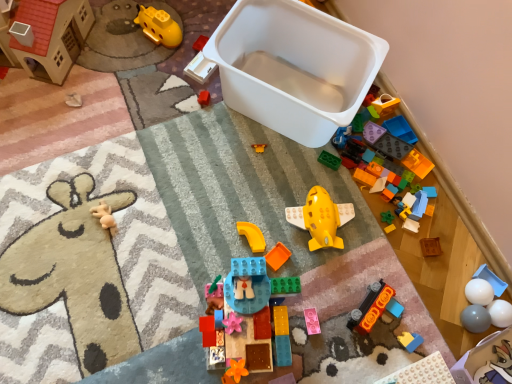
Locate an element on the screen. Image resolution: width=512 pixels, height=384 pixels. free space to the back side of translucent blue plastic building block at center, the 12th toy from the right is located at coordinates (246, 244).